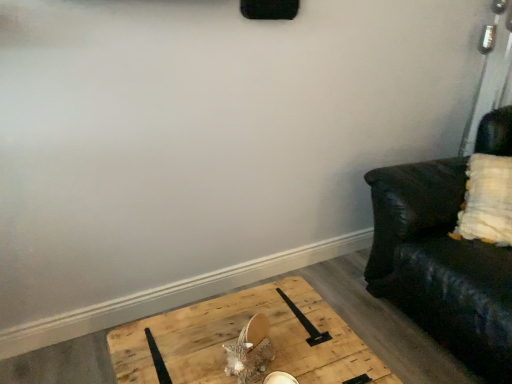
This screenshot has width=512, height=384. What do you see at coordinates (239, 339) in the screenshot?
I see `wooden pallet at lower center` at bounding box center [239, 339].

You are a GUI agent. You are given a task and a screenshot of the screen. Output one action in this format:
    pyautogui.click(x=<x>, y=<y>)
    Task: Click on the wooden pallet at lower center
    The height and width of the screenshot is (384, 512).
    Given the screenshot: What is the action you would take?
    pyautogui.click(x=239, y=339)

Measure the distance between wooden pallet at lower center and camera.

They are 1.12 meters apart.

This screenshot has width=512, height=384. I want to click on black leather couch at right, so click(440, 265).

Image resolution: width=512 pixels, height=384 pixels. What do you see at coordinates (440, 265) in the screenshot? I see `black leather couch at right` at bounding box center [440, 265].

The image size is (512, 384). Identify the location of wooden pallet at lower center. (239, 339).

Is black leather couch at right at the right side of wooden pallet at lower center?

Yes, black leather couch at right is to the right of wooden pallet at lower center.

Between black leather couch at right and wooden pallet at lower center, which one is positioned behind?

black leather couch at right is more distant.

Is point (464, 162) closer to camera compared to point (376, 363)?

No, it is not.

From the image's perspective, is black leather couch at right above wooden pallet at lower center?

Yes, from the image's perspective, black leather couch at right is over wooden pallet at lower center.

From a real-world perspective, does black leather couch at right sit lower than wooden pallet at lower center?

No, from a real-world perspective, black leather couch at right is not beneath wooden pallet at lower center.

Between black leather couch at right and wooden pallet at lower center, which one has larger width?

With larger width is black leather couch at right.

Is black leather couch at right taller or shorter than wooden pallet at lower center?

black leather couch at right is taller than wooden pallet at lower center.

Considering the relative sizes of black leather couch at right and wooden pallet at lower center in the image provided, is black leather couch at right smaller than wooden pallet at lower center?

Actually, black leather couch at right might be larger than wooden pallet at lower center.

Choose the correct answer: Is black leather couch at right inside wooden pallet at lower center or outside it?

black leather couch at right is not inside wooden pallet at lower center, it's outside.

Would you say black leather couch at right is a long distance from wooden pallet at lower center?

That's not correct — black leather couch at right is a little close to wooden pallet at lower center.

Is black leather couch at right facing towards wooden pallet at lower center?

Yes, black leather couch at right is facing wooden pallet at lower center.

What's the angular difference between black leather couch at right and wooden pallet at lower center's facing directions?

The angular difference between black leather couch at right and wooden pallet at lower center is 87.4 degrees.

Measure the distance from black leather couch at right to wooden pallet at lower center.

They are 62.04 centimeters apart.

The height and width of the screenshot is (384, 512). What are the coordinates of `table located underneath the black leather couch at right (from a real-world perspective)` in the screenshot? It's located at (239, 339).

Considering the positions of objects wooden pallet at lower center and black leather couch at right in the image provided, who is more to the right, wooden pallet at lower center or black leather couch at right?

From the viewer's perspective, black leather couch at right appears more on the right side.

Considering the relative positions of wooden pallet at lower center and black leather couch at right in the image provided, is wooden pallet at lower center in front of black leather couch at right?

Yes, wooden pallet at lower center is closer to the camera.

Considering the positions of points (142, 358) and (472, 332), is point (142, 358) closer to camera compared to point (472, 332)?

Yes, it is.

From the image's perspective, which object appears higher, wooden pallet at lower center or black leather couch at right?

black leather couch at right appears higher in the image.

From a real-world perspective, is wooden pallet at lower center below black leather couch at right?

Yes, from a real-world perspective, wooden pallet at lower center is under black leather couch at right.

Considering the sizes of wooden pallet at lower center and black leather couch at right in the image, is wooden pallet at lower center wider or thinner than black leather couch at right?

Considering their sizes, wooden pallet at lower center looks slimmer than black leather couch at right.

Which of these two, wooden pallet at lower center or black leather couch at right, stands taller?

black leather couch at right is taller.

Is wooden pallet at lower center bigger or smaller than black leather couch at right?

Clearly, wooden pallet at lower center is smaller in size than black leather couch at right.

Is wooden pallet at lower center inside or outside of black leather couch at right?

wooden pallet at lower center exists outside the volume of black leather couch at right.

Would you consider wooden pallet at lower center to be distant from black leather couch at right?

No.

Does wooden pallet at lower center turn towards black leather couch at right?

No, wooden pallet at lower center is not oriented towards black leather couch at right.

The height and width of the screenshot is (384, 512). I want to click on table on the left of the black leather couch at right, so click(239, 339).

Where is `table in front of the black leather couch at right`? The image size is (512, 384). table in front of the black leather couch at right is located at coordinates (239, 339).

This screenshot has height=384, width=512. In order to click on studio couch behind the wooden pallet at lower center in this screenshot , I will do `click(440, 265)`.